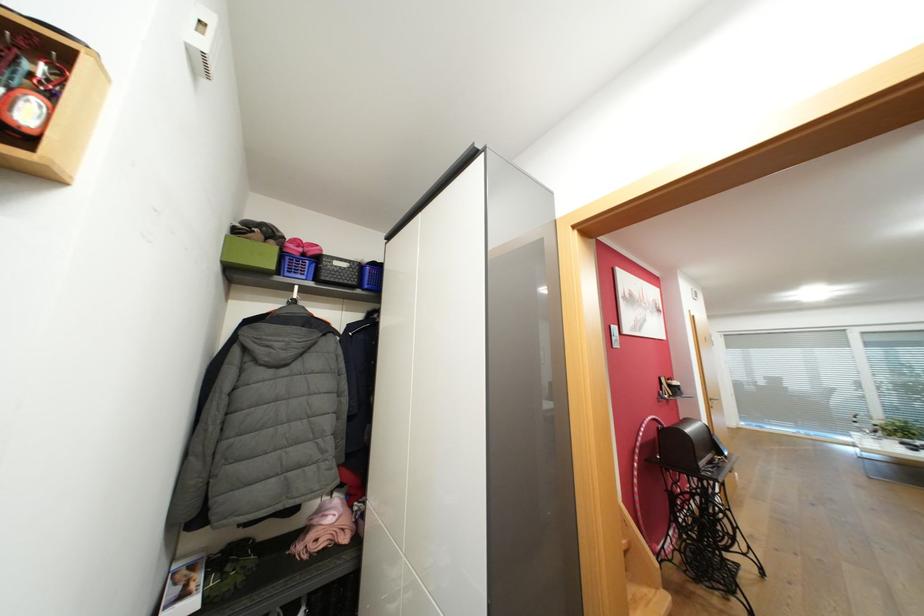
Where would you lift the clothes hanger hook? Please return your answer as a coordinate pair (x, y).

(294, 296)